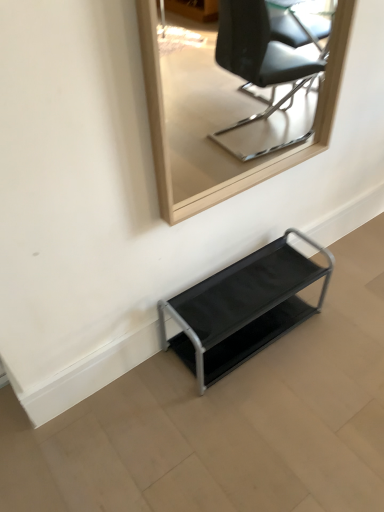
Question: From a real-world perspective, relative to wooden frame mirror at upper center, is metallic gray shelf at lower center vertically above or below?

Choices:
 (A) above
 (B) below

Answer: (B)

Question: In the image, is metallic gray shelf at lower center positioned in front of or behind wooden frame mirror at upper center?

Choices:
 (A) behind
 (B) front

Answer: (A)

Question: From their relative heights in the image, would you say metallic gray shelf at lower center is taller or shorter than wooden frame mirror at upper center?

Choices:
 (A) tall
 (B) short

Answer: (B)

Question: From their relative heights in the image, would you say wooden frame mirror at upper center is taller or shorter than metallic gray shelf at lower center?

Choices:
 (A) tall
 (B) short

Answer: (A)

Question: Considering the positions of wooden frame mirror at upper center and metallic gray shelf at lower center in the image, is wooden frame mirror at upper center bigger or smaller than metallic gray shelf at lower center?

Choices:
 (A) big
 (B) small

Answer: (B)

Question: Is wooden frame mirror at upper center wider or thinner than metallic gray shelf at lower center?

Choices:
 (A) thin
 (B) wide

Answer: (A)

Question: Relative to metallic gray shelf at lower center, is wooden frame mirror at upper center in front or behind?

Choices:
 (A) front
 (B) behind

Answer: (A)